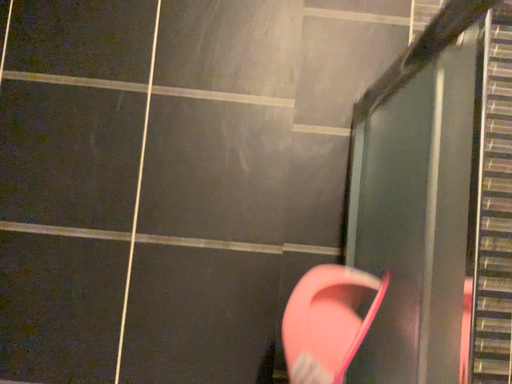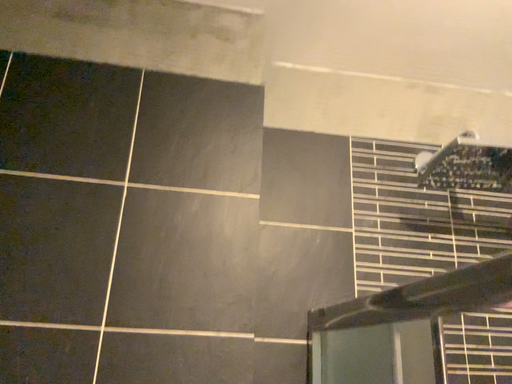
Question: How did the camera likely rotate when shooting the video?

Choices:
 (A) rotated upward
 (B) rotated downward

Answer: (A)